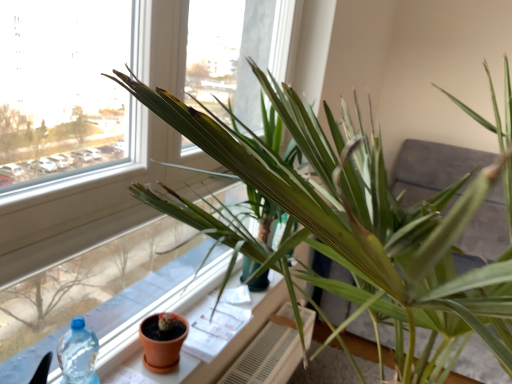
Question: From a real-world perspective, is green matte plant at center positioned above or below terracotta clay pot at lower left?

Choices:
 (A) above
 (B) below

Answer: (A)

Question: Is green matte plant at center to the left or to the right of terracotta clay pot at lower left in the image?

Choices:
 (A) right
 (B) left

Answer: (A)

Question: Which object is the closest to the terracotta clay pot at lower center?

Choices:
 (A) green matte plant at center
 (B) terracotta clay pot at lower left
 (C) white textured radiator at lower center

Answer: (C)

Question: Considering the real-world distances, which object is farthest from the green matte plant at center?

Choices:
 (A) terracotta clay pot at lower center
 (B) terracotta clay pot at lower left
 (C) white textured radiator at lower center

Answer: (C)